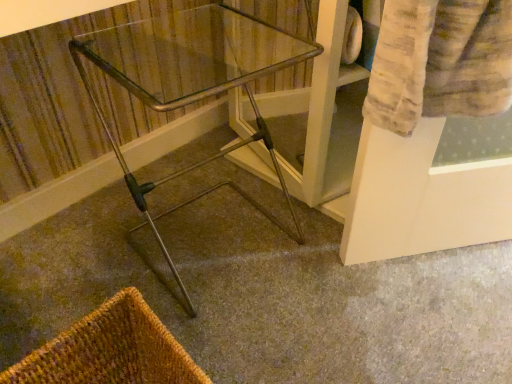
Question: From the image's perspective, is brown woven basket at lower left on metallic silver walker at center?

Choices:
 (A) no
 (B) yes

Answer: (A)

Question: Can you confirm if brown woven basket at lower left is bigger than metallic silver walker at center?

Choices:
 (A) yes
 (B) no

Answer: (B)

Question: Can you confirm if brown woven basket at lower left is smaller than metallic silver walker at center?

Choices:
 (A) yes
 (B) no

Answer: (A)

Question: Is brown woven basket at lower left thinner than metallic silver walker at center?

Choices:
 (A) yes
 (B) no

Answer: (A)

Question: Is brown woven basket at lower left not within metallic silver walker at center?

Choices:
 (A) yes
 (B) no

Answer: (A)

Question: Is brown woven basket at lower left far from metallic silver walker at center?

Choices:
 (A) no
 (B) yes

Answer: (A)

Question: Is brown woven basket at lower left touching clear glass table at center?

Choices:
 (A) no
 (B) yes

Answer: (A)

Question: From a real-world perspective, does brown woven basket at lower left stand above clear glass table at center?

Choices:
 (A) no
 (B) yes

Answer: (A)

Question: Can you confirm if brown woven basket at lower left is shorter than clear glass table at center?

Choices:
 (A) no
 (B) yes

Answer: (B)

Question: Considering the relative positions of brown woven basket at lower left and clear glass table at center in the image provided, is brown woven basket at lower left to the left of clear glass table at center from the viewer's perspective?

Choices:
 (A) no
 (B) yes

Answer: (B)

Question: From the image's perspective, is brown woven basket at lower left located beneath clear glass table at center?

Choices:
 (A) no
 (B) yes

Answer: (B)

Question: Does brown woven basket at lower left have a greater width compared to clear glass table at center?

Choices:
 (A) yes
 (B) no

Answer: (B)

Question: From a real-world perspective, is clear glass table at center located higher than metallic silver walker at center?

Choices:
 (A) yes
 (B) no

Answer: (A)